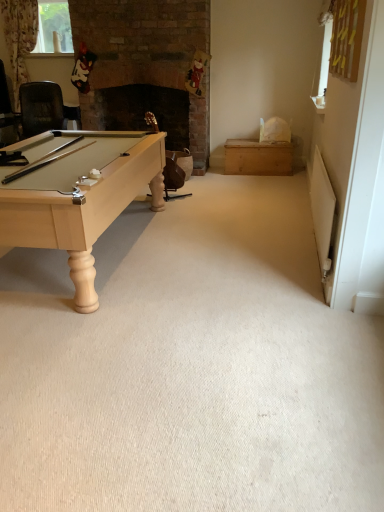
What do you see at coordinates (53, 26) in the screenshot? The width and height of the screenshot is (384, 512). I see `clear glass window at upper left` at bounding box center [53, 26].

What do you see at coordinates (258, 158) in the screenshot? I see `wooden chest at right` at bounding box center [258, 158].

Where is `wooden swivel chair at center`? wooden swivel chair at center is located at coordinates (174, 179).

At what (x,y) coordinates should I click in order to perform the action: click on clear glass window at upper left. Please return your answer as a coordinate pair (x, y). Looking at the image, I should click on (53, 26).

The image size is (384, 512). Identify the location of window screen above the wooden chest at right (from the image's perspective). (53, 26).

Does wooden chest at right turn towards clear glass window at upper left?

No.

From the image's perspective, who appears lower, wooden chest at right or clear glass window at upper left?

wooden chest at right appears lower in the image.

Which object is positioned more to the right, wooden chest at right or clear glass window at upper left?

From the viewer's perspective, wooden chest at right appears more on the right side.

Does clear glass window at upper left have a greater width compared to wooden swivel chair at center?

No, clear glass window at upper left is not wider than wooden swivel chair at center.

Which object is closer to the camera taking this photo, clear glass window at upper left or wooden swivel chair at center?

wooden swivel chair at center is more forward.

Between clear glass window at upper left and wooden swivel chair at center, which one has less height?

clear glass window at upper left.

In the scene shown: Can you tell me how much clear glass window at upper left and wooden swivel chair at center differ in facing direction?

They differ by 1.3 degrees in their facing directions.

Can you tell me how much wooden swivel chair at center and clear glass window at upper left differ in facing direction?

There is a 1.3-degree angle between the facing directions of wooden swivel chair at center and clear glass window at upper left.

Identify the location of swivel chair on the right of clear glass window at upper left. (174, 179).

Can you confirm if wooden swivel chair at center is shorter than clear glass window at upper left?

In fact, wooden swivel chair at center may be taller than clear glass window at upper left.

From a real-world perspective, who is located higher, clear glass window at upper left or wooden chest at right?

clear glass window at upper left.

Does clear glass window at upper left appear on the right side of wooden chest at right?

No, clear glass window at upper left is not to the right of wooden chest at right.

Can you confirm if clear glass window at upper left is wider than wooden chest at right?

Incorrect, the width of clear glass window at upper left does not surpass that of wooden chest at right.

Which point is more forward, [62,5] or [276,151]?

The point [276,151] is closer.

Does wooden chest at right appear on the right side of wooden swivel chair at center?

Yes.

Which of these two, wooden chest at right or wooden swivel chair at center, is thinner?

wooden swivel chair at center.

Would you say wooden chest at right is inside or outside wooden swivel chair at center?

wooden chest at right is outside wooden swivel chair at center.

Is wooden chest at right far away from wooden swivel chair at center?

wooden chest at right is far away from wooden swivel chair at center.

In the scene shown: From a real-world perspective, is wooden swivel chair at center physically above wooden chest at right?

Yes, from a real-world perspective, wooden swivel chair at center is on top of wooden chest at right.

Which is more to the left, wooden swivel chair at center or wooden chest at right?

wooden swivel chair at center.

Considering the relative sizes of wooden swivel chair at center and wooden chest at right in the image provided, is wooden swivel chair at center wider than wooden chest at right?

Incorrect, the width of wooden swivel chair at center does not surpass that of wooden chest at right.

How different are the orientations of wooden swivel chair at center and wooden chest at right in degrees?

1.1 degrees.

Locate an element on the screen. The image size is (384, 512). drawer in front of the clear glass window at upper left is located at coordinates (258, 158).

Where is `swivel chair on the right of clear glass window at upper left`? This screenshot has width=384, height=512. swivel chair on the right of clear glass window at upper left is located at coordinates (174, 179).

When comparing their distances from wooden swivel chair at center, does clear glass window at upper left or wooden chest at right seem further?

Based on the image, clear glass window at upper left appears to be further to wooden swivel chair at center.

When comparing their distances from clear glass window at upper left, does wooden chest at right or wooden swivel chair at center seem closer?

Among the two, wooden swivel chair at center is located nearer to clear glass window at upper left.

Looking at the image, which one is located further to wooden chest at right, clear glass window at upper left or wooden swivel chair at center?

The object further to wooden chest at right is clear glass window at upper left.

From the image, which object appears to be farther from wooden chest at right, wooden swivel chair at center or clear glass window at upper left?

clear glass window at upper left.

From the image, which object appears to be nearer to clear glass window at upper left, wooden swivel chair at center or wooden chest at right?

The object closer to clear glass window at upper left is wooden swivel chair at center.

Estimate the real-world distances between objects in this image. Which object is closer to wooden swivel chair at center, wooden chest at right or clear glass window at upper left?

Based on the image, wooden chest at right appears to be nearer to wooden swivel chair at center.

This screenshot has height=512, width=384. What are the coordinates of `swivel chair situated between clear glass window at upper left and wooden chest at right from left to right` in the screenshot? It's located at (174, 179).